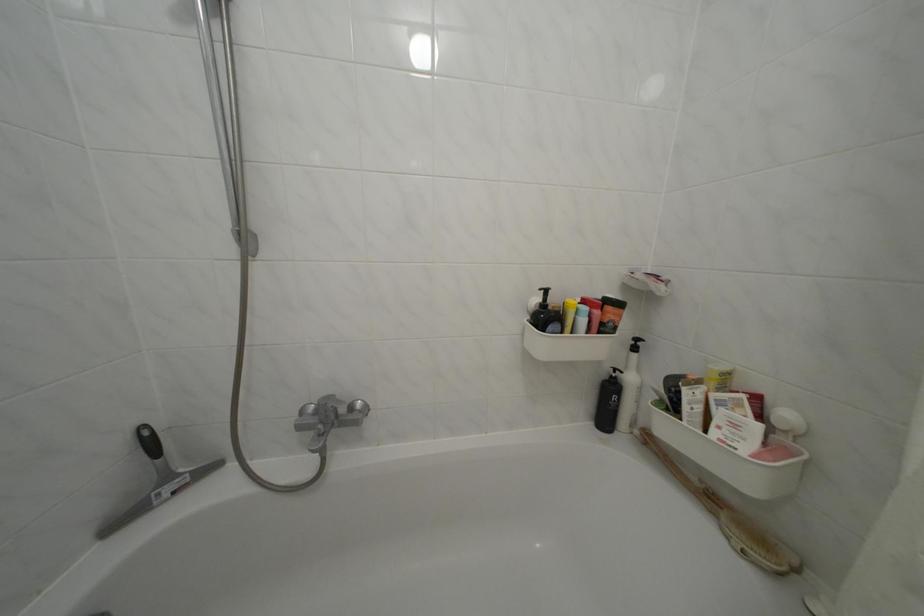
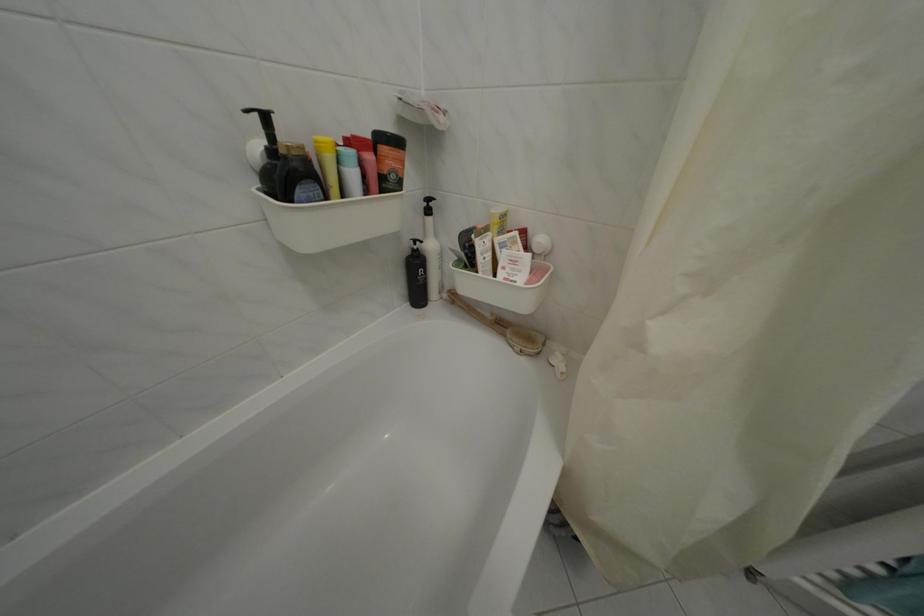
Locate, in the second image, the point that corresponds to pixel 599 329 in the first image.

(372, 182)